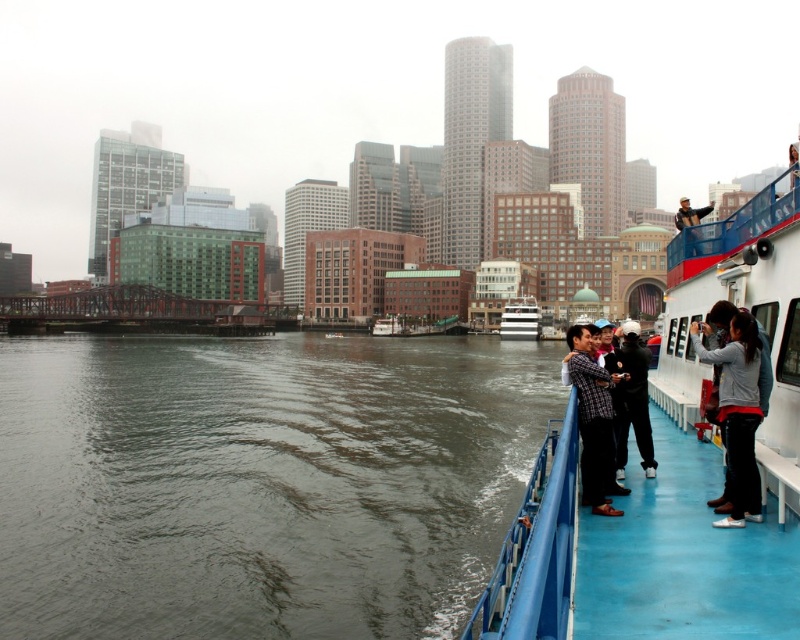
Question: Which point appears farthest from the camera in this image?

Choices:
 (A) (192, 376)
 (B) (501, 316)
 (C) (374, 323)
 (D) (632, 349)

Answer: (C)

Question: Which of the following is the closest to the observer?

Choices:
 (A) white glossy boat at center
 (B) gray fleece jacket at upper right

Answer: (B)

Question: In this image, where is dark gray water at center located relative to blue rubber deck at right?

Choices:
 (A) right
 (B) left

Answer: (B)

Question: Can you confirm if blue rubber deck at right is positioned below dark gray fabric jacket at right?

Choices:
 (A) no
 (B) yes

Answer: (B)

Question: Among these points, which one is farthest from the camera?

Choices:
 (A) (737, 339)
 (B) (633, 483)
 (C) (628, 403)
 (D) (381, 326)

Answer: (D)

Question: Is blue rubber deck at right further to camera compared to white wooden boat at center?

Choices:
 (A) no
 (B) yes

Answer: (A)